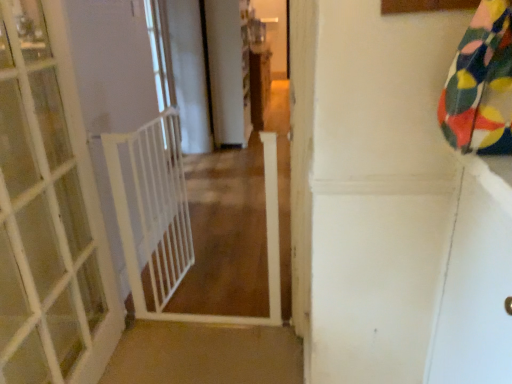
What do you see at coordinates (160, 53) in the screenshot?
I see `white plastic gate at left` at bounding box center [160, 53].

This screenshot has width=512, height=384. Describe the element at coordinates (476, 280) in the screenshot. I see `white glossy screen door at upper right` at that location.

The image size is (512, 384). What do you see at coordinates (226, 235) in the screenshot?
I see `white plastic gate at center` at bounding box center [226, 235].

Measure the distance between point (284,248) and camera.

Point (284,248) and camera are 1.80 meters apart from each other.

Find the location of a particular element. The image size is (512, 384). white plastic balustrade at left is located at coordinates (153, 207).

From the picture: Looking at their sizes, would you say white plastic balustrade at left is wider or thinner than white plastic gate at left?

Clearly, white plastic balustrade at left has less width compared to white plastic gate at left.

Is white plastic balustrade at left facing away from white plastic gate at left?

white plastic balustrade at left does not have its back to white plastic gate at left.

Which is in front, point (120, 234) or point (153, 3)?

Positioned in front is point (120, 234).

From the image's perspective, is white wooden door at left beneath white glossy screen door at upper right?

No.

Find the location of a particular element. This screenshot has height=384, width=512. door behind the white glossy screen door at upper right is located at coordinates (49, 214).

Does white wooden door at left turn towards white glossy screen door at upper right?

Yes, white wooden door at left is turned towards white glossy screen door at upper right.

Considering the relative sizes of white wooden door at left and white glossy screen door at upper right in the image provided, is white wooden door at left smaller than white glossy screen door at upper right?

Result: Incorrect, white wooden door at left is not smaller in size than white glossy screen door at upper right.

Considering the relative positions of white wooden door at left and white plastic gate at left in the image provided, is white wooden door at left in front of white plastic gate at left?

Yes, white wooden door at left is in front of white plastic gate at left.

Does point (84, 300) come behind point (168, 55)?

No, (84, 300) is closer to viewer.

Find the location of a particular element. window that is above the white glossy screen door at upper right (from a real-world perspective) is located at coordinates (160, 53).

Between white plastic gate at left and white glossy screen door at upper right, which one appears on the right side from the viewer's perspective?

white glossy screen door at upper right is more to the right.

From a real-world perspective, which is physically below, white glossy screen door at upper right or white plastic gate at left?

white glossy screen door at upper right.

Considering the sizes of objects white glossy screen door at upper right and white plastic gate at left in the image provided, who is thinner, white glossy screen door at upper right or white plastic gate at left?

white plastic gate at left.

In the image, is white glossy screen door at upper right positioned in front of or behind white plastic gate at left?

Clearly, white glossy screen door at upper right is in front of white plastic gate at left.

Does point (174, 154) lie in front of point (472, 179)?

That is False.

Is white plastic balustrade at left positioned before white glossy screen door at upper right?

No, white plastic balustrade at left is behind white glossy screen door at upper right.

Is white plastic balustrade at left to the left or to the right of white glossy screen door at upper right in the image?

white plastic balustrade at left is to the left of white glossy screen door at upper right.

Can you confirm if white plastic balustrade at left is shorter than white glossy screen door at upper right?

No.

From the image's perspective, is white glossy screen door at upper right located above white wooden door at left?

No, from the image's perspective, white glossy screen door at upper right is not above white wooden door at left.

Which is closer, (480, 257) or (68, 107)?

Point (480, 257) is closer to the camera than point (68, 107).

Between white glossy screen door at upper right and white wooden door at left, which one has larger width?

white wooden door at left.

Is white glossy screen door at upper right directly adjacent to white wooden door at left?

There is a gap between white glossy screen door at upper right and white wooden door at left.

You are a GUI agent. You are given a task and a screenshot of the screen. Output one action in this format:
    pyautogui.click(x=<x>, y=<y>)
    Task: Click on the window that is above the white plastic balustrade at left (from the image's perspective)
    This screenshot has height=384, width=512.
    Given the screenshot: What is the action you would take?
    pyautogui.click(x=160, y=53)

You are a GUI agent. You are given a task and a screenshot of the screen. Output one action in this format:
    pyautogui.click(x=<x>, y=<y>)
    Task: Click on the screen door in front of the white wooden door at left
    
    Given the screenshot: What is the action you would take?
    pyautogui.click(x=476, y=280)

Estimate the real-world distances between objects in this image. Which object is further from white wooden door at left, white plastic gate at left or white glossy screen door at upper right?

white plastic gate at left lies further to white wooden door at left than the other object.

Based on their spatial positions, is white plastic gate at left or white plastic gate at center further from white glossy screen door at upper right?

The object further to white glossy screen door at upper right is white plastic gate at left.

When comparing their distances from white plastic balustrade at left, does white plastic gate at left or white plastic gate at center seem closer?

white plastic gate at center lies closer to white plastic balustrade at left than the other object.

Estimate the real-world distances between objects in this image. Which object is further from white glossy screen door at upper right, white plastic balustrade at left or white plastic gate at center?

white plastic balustrade at left.

Which object lies further to the anchor point white wooden door at left, white plastic gate at left or white plastic gate at center?

white plastic gate at left.

Looking at the image, which one is located further to white glossy screen door at upper right, white plastic gate at center or white plastic balustrade at left?

white plastic balustrade at left lies further to white glossy screen door at upper right than the other object.

When comparing their distances from white plastic gate at center, does white plastic gate at left or white glossy screen door at upper right seem further?

white plastic gate at left is further to white plastic gate at center.

Which object lies nearer to the anchor point white glossy screen door at upper right, white wooden door at left or white plastic balustrade at left?

white wooden door at left is positioned closer to the anchor white glossy screen door at upper right.

This screenshot has width=512, height=384. I want to click on path positioned between white glossy screen door at upper right and white plastic balustrade at left from near to far, so click(x=226, y=235).

Where is `balustrade between white glossy screen door at upper right and white plastic gate at left along the z-axis`? The image size is (512, 384). balustrade between white glossy screen door at upper right and white plastic gate at left along the z-axis is located at coordinates (153, 207).

Image resolution: width=512 pixels, height=384 pixels. Find the location of `path between white wooden door at left and white plastic balustrade at left in the front-back direction`. path between white wooden door at left and white plastic balustrade at left in the front-back direction is located at coordinates coord(226,235).

You are a GUI agent. You are given a task and a screenshot of the screen. Output one action in this format:
    pyautogui.click(x=<x>, y=<y>)
    Task: Click on the balustrade located between white wooden door at left and white glossy screen door at upper right in the left-right direction
    Image resolution: width=512 pixels, height=384 pixels.
    Given the screenshot: What is the action you would take?
    pyautogui.click(x=153, y=207)